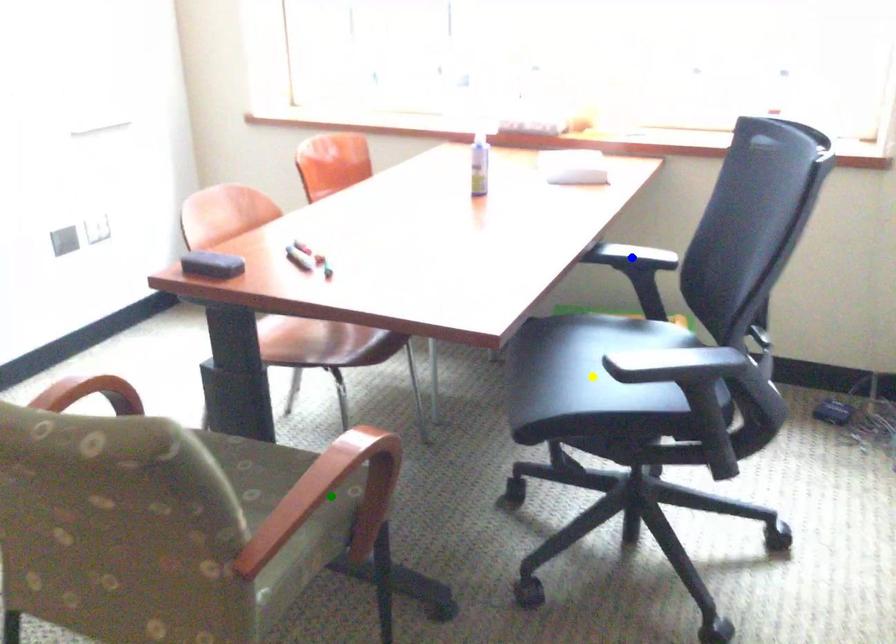
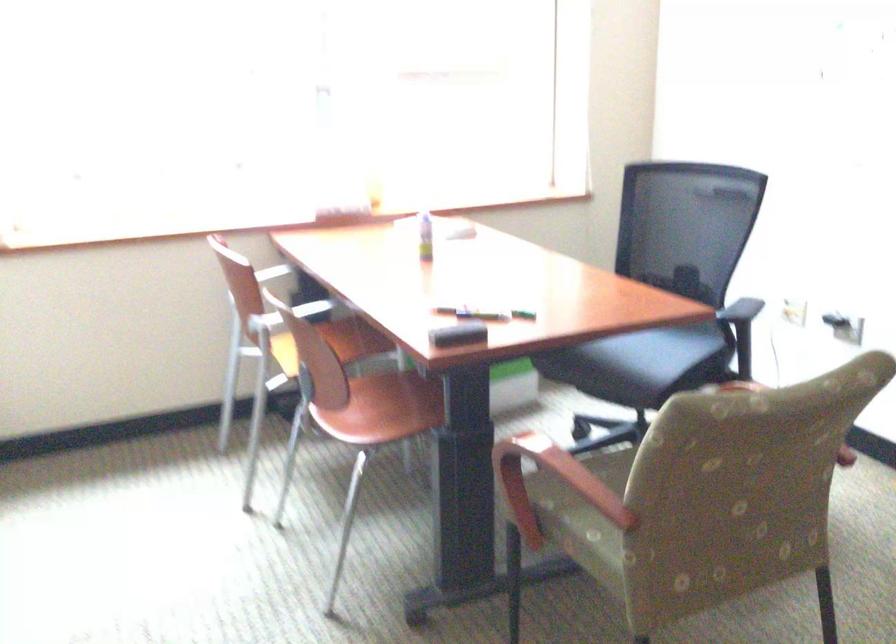
I am providing you with two images of the same scene from different viewpoints. Three points are marked in image1. Which point corresponds to a part or object that is occluded in image2?In image1, three points are marked. Which of them correspond to a part or object that is occluded in image2?Among the three points shown in image1, which one corresponds to a part or object that is no longer visible due to occlusion in image2?

Invisible in image2: blue point, green point.